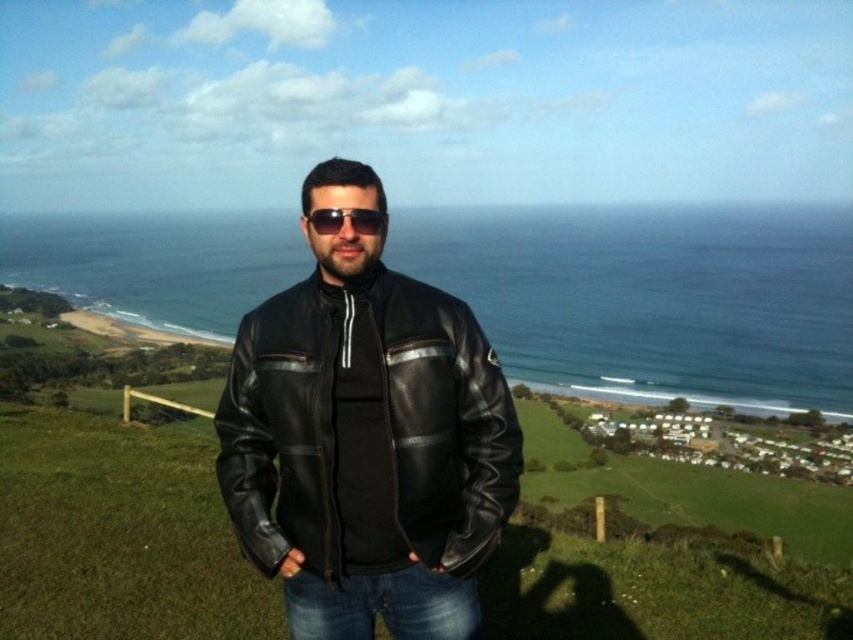
Question: Considering the relative positions of black leather jacket at center and jeans at center in the image provided, where is black leather jacket at center located with respect to jeans at center?

Choices:
 (A) above
 (B) below

Answer: (A)

Question: Which point appears farthest from the camera in this image?

Choices:
 (A) (842, 528)
 (B) (325, 232)
 (C) (412, 592)
 (D) (503, 506)

Answer: (A)

Question: Estimate the real-world distances between objects in this image. Which object is closer to the sunglasses at center?

Choices:
 (A) green grass at center
 (B) black leather jacket at center
 (C) jeans at center

Answer: (B)

Question: Among these points, which one is nearest to the camera?

Choices:
 (A) (589, 472)
 (B) (370, 211)

Answer: (B)

Question: Does black leather jacket at center come in front of sunglasses at center?

Choices:
 (A) yes
 (B) no

Answer: (B)

Question: Can you confirm if black leather jacket at center is positioned above jeans at center?

Choices:
 (A) yes
 (B) no

Answer: (A)